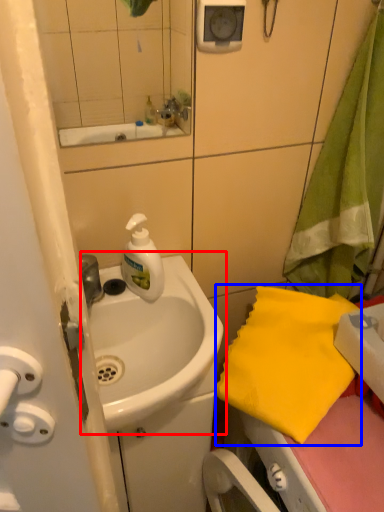
Question: Which point is further to the camera, sink (highlighted by a red box) or beach towel (highlighted by a blue box)?

Choices:
 (A) sink
 (B) beach towel

Answer: (B)